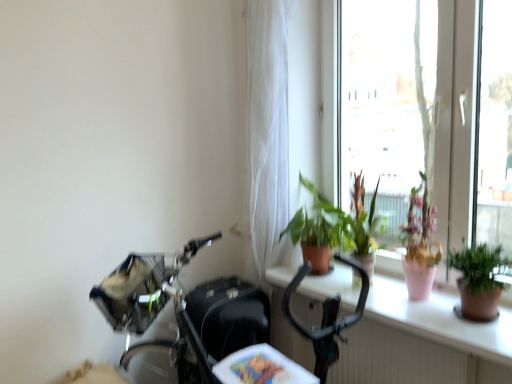
Question: Can green matte plant at upper right, the 2th houseplant when ordered from left to right, be found inside terracotta pot at center?

Choices:
 (A) no
 (B) yes

Answer: (A)

Question: Is terracotta pot at center thinner than green matte plant at upper right, which appears as the 1th houseplant when viewed from the front?

Choices:
 (A) no
 (B) yes

Answer: (A)

Question: Is terracotta pot at center looking in the opposite direction of green matte plant at upper right, the 2th houseplant when ordered from left to right?

Choices:
 (A) no
 (B) yes

Answer: (A)

Question: Considering the relative positions of terracotta pot at center and green matte plant at upper right, the 2th houseplant when ordered from left to right, in the image provided, is terracotta pot at center to the right of green matte plant at upper right, the 2th houseplant when ordered from left to right, from the viewer's perspective?

Choices:
 (A) no
 (B) yes

Answer: (A)

Question: Is terracotta pot at center positioned behind green matte plant at upper right, placed as the first houseplant when sorted from right to left?

Choices:
 (A) no
 (B) yes

Answer: (A)

Question: From a real-world perspective, relative to green matte plant at upper right, the second houseplant in the back-to-front sequence, is transparent glass window at upper right vertically above or below?

Choices:
 (A) above
 (B) below

Answer: (A)

Question: Considering the positions of transparent glass window at upper right and green matte plant at upper right, which appears as the 1th houseplant when viewed from the front, in the image, is transparent glass window at upper right wider or thinner than green matte plant at upper right, which appears as the 1th houseplant when viewed from the front,?

Choices:
 (A) thin
 (B) wide

Answer: (A)

Question: Is point (442, 11) closer or farther from the camera than point (471, 254)?

Choices:
 (A) farther
 (B) closer

Answer: (A)

Question: Relative to green matte plant at upper right, the 2th houseplant when ordered from left to right, is transparent glass window at upper right in front or behind?

Choices:
 (A) front
 (B) behind

Answer: (B)

Question: Based on their sizes in the image, would you say green matte plant at upper right, which appears as the 1th houseplant when viewed from the front, is bigger or smaller than black matte mountain bike at center?

Choices:
 (A) small
 (B) big

Answer: (A)

Question: Relative to black matte mountain bike at center, is green matte plant at upper right, the second houseplant in the back-to-front sequence, in front or behind?

Choices:
 (A) behind
 (B) front

Answer: (A)

Question: Is green matte plant at upper right, the second houseplant in the back-to-front sequence, to the left or to the right of black matte mountain bike at center in the image?

Choices:
 (A) right
 (B) left

Answer: (A)

Question: Choose the correct answer: Is green matte plant at upper right, the 2th houseplant when ordered from left to right, inside black matte mountain bike at center or outside it?

Choices:
 (A) inside
 (B) outside

Answer: (B)

Question: Relative to black matte mountain bike at center, is terracotta pot at center in front or behind?

Choices:
 (A) front
 (B) behind

Answer: (B)

Question: From a real-world perspective, is terracotta pot at center above or below black matte mountain bike at center?

Choices:
 (A) below
 (B) above

Answer: (B)